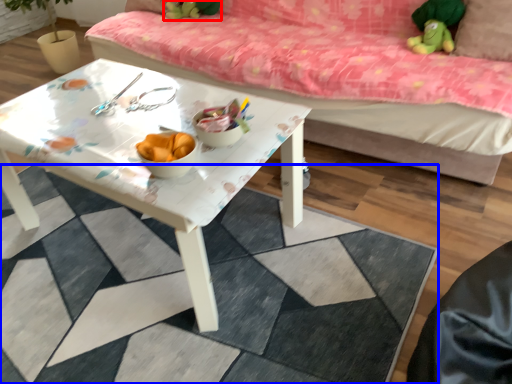
Question: Which object appears farthest to the camera in this image, toy (highlighted by a red box) or tile (highlighted by a blue box)?

Choices:
 (A) toy
 (B) tile

Answer: (A)